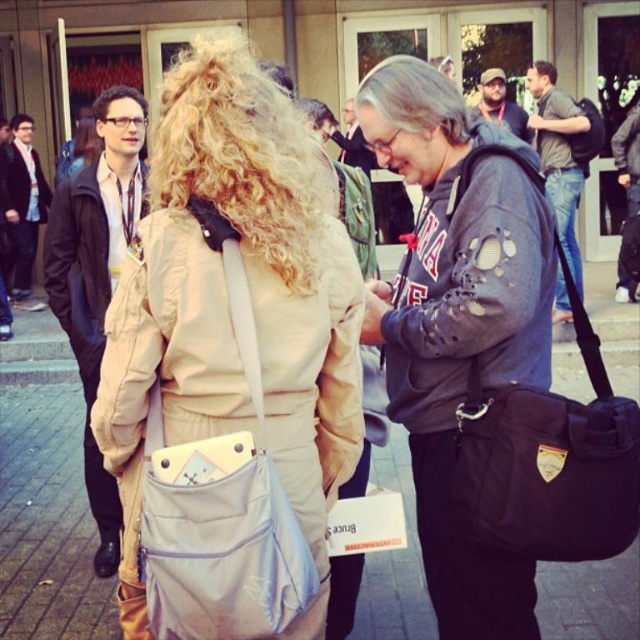
Does beige fabric jacket at center have a greater width compared to black fabric bag at center?

Indeed, beige fabric jacket at center has a greater width compared to black fabric bag at center.

Can you confirm if beige fabric jacket at center is positioned to the left of black fabric bag at center?

Correct, you'll find beige fabric jacket at center to the left of black fabric bag at center.

Locate an element on the screen. beige fabric jacket at center is located at coordinates (458, 320).

Is beige fabric jacket at center shorter than gray fabric bag at center?

No, beige fabric jacket at center is not shorter than gray fabric bag at center.

Can you confirm if beige fabric jacket at center is thinner than gray fabric bag at center?

Yes, beige fabric jacket at center is thinner than gray fabric bag at center.

Find the location of a particular element. beige fabric jacket at center is located at coordinates (458, 320).

Where is `beige fabric jacket at center`? The width and height of the screenshot is (640, 640). beige fabric jacket at center is located at coordinates (x=458, y=320).

Which of these two, beige fabric jacket at center or light blue fabric bag at center, stands shorter?

light blue fabric bag at center is shorter.

Between beige fabric jacket at center and light blue fabric bag at center, which one is positioned higher?

beige fabric jacket at center is above.

Which is in front, point (464, 576) or point (160, 396)?

Point (160, 396) is more forward.

At what (x,y) coordinates should I click in order to perform the action: click on beige fabric jacket at center. Please return your answer as a coordinate pair (x, y). This screenshot has width=640, height=640. Looking at the image, I should click on (458, 320).